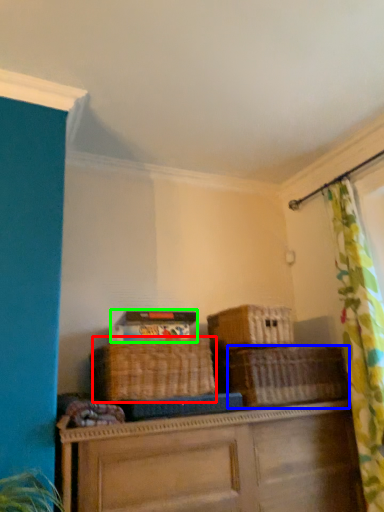
Question: Considering the real-world distances, which object is farthest from basket (highlighted by a red box)? basket (highlighted by a blue box) or storage box (highlighted by a green box)?

Choices:
 (A) basket
 (B) storage box

Answer: (A)